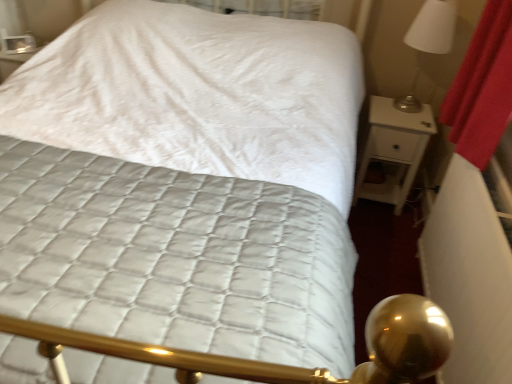
Question: Is white glossy lampshade at upper right in front of or behind white glossy nightstand at right in the image?

Choices:
 (A) front
 (B) behind

Answer: (A)

Question: In terms of width, does white glossy lampshade at upper right look wider or thinner when compared to white glossy nightstand at right?

Choices:
 (A) wide
 (B) thin

Answer: (B)

Question: Is white glossy lampshade at upper right bigger or smaller than white glossy nightstand at right?

Choices:
 (A) big
 (B) small

Answer: (B)

Question: Looking at their shapes, would you say white glossy nightstand at right is wider or thinner than white glossy lampshade at upper right?

Choices:
 (A) wide
 (B) thin

Answer: (A)

Question: Considering the relative positions of white glossy nightstand at right and white glossy lampshade at upper right in the image provided, is white glossy nightstand at right to the left or to the right of white glossy lampshade at upper right?

Choices:
 (A) left
 (B) right

Answer: (A)

Question: In terms of height, does white glossy nightstand at right look taller or shorter compared to white glossy lampshade at upper right?

Choices:
 (A) tall
 (B) short

Answer: (A)

Question: From the image's perspective, relative to white glossy lampshade at upper right, is white glossy nightstand at right above or below?

Choices:
 (A) below
 (B) above

Answer: (A)